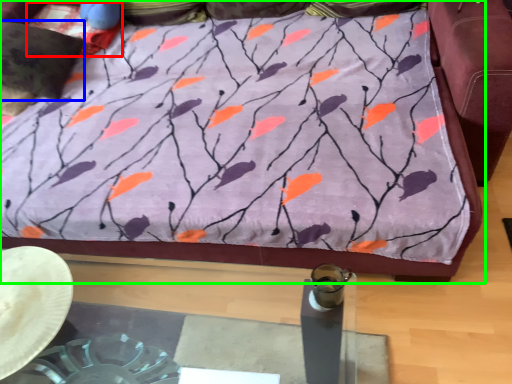
Question: Which is farther away from pillow (highlighted by a red box)? pillow (highlighted by a blue box) or furniture (highlighted by a green box)?

Choices:
 (A) pillow
 (B) furniture

Answer: (B)